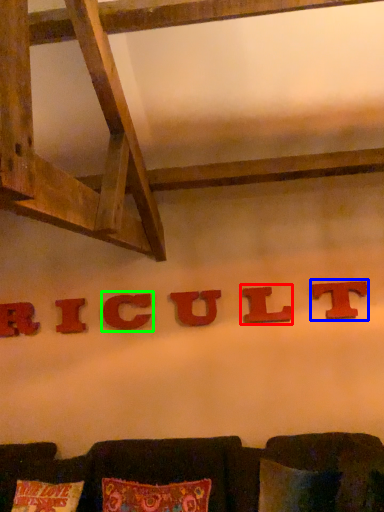
Question: Which object is the farthest from alphabet (highlighted by a red box)? Choose among these: alphabet (highlighted by a blue box) or alphabet (highlighted by a green box).

Choices:
 (A) alphabet
 (B) alphabet

Answer: (B)